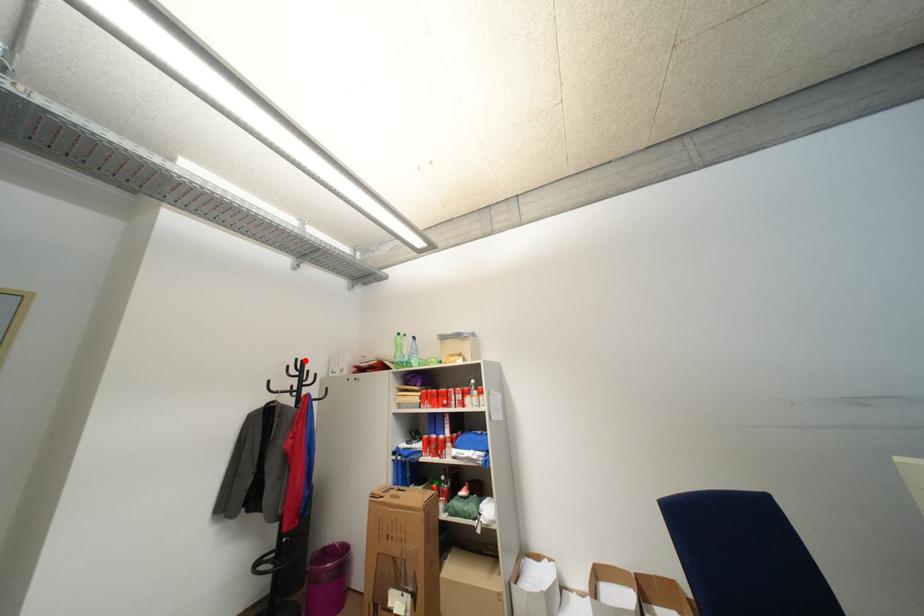
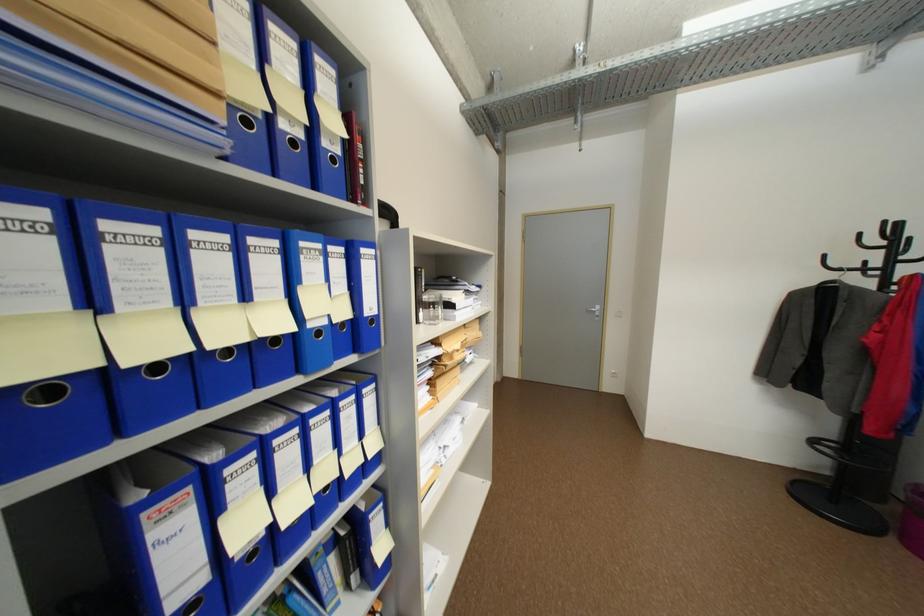
Locate, in the second image, the point that corresponds to the highlighted location in the first image.

(893, 224)